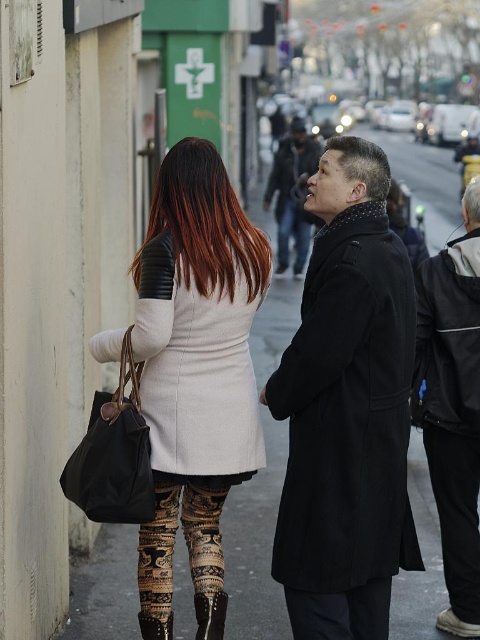
Question: Can you confirm if black wool coat at center is bigger than black leather jacket at right?

Choices:
 (A) yes
 (B) no

Answer: (B)

Question: Is ombre brown hair at center to the right of brown textured leggings at lower center from the viewer's perspective?

Choices:
 (A) yes
 (B) no

Answer: (A)

Question: Which point is closer to the camera?

Choices:
 (A) leather leggings at left
 (B) gray matte hair at center
 (C) ombre brown hair at center
 (D) black leather jacket at right

Answer: (A)

Question: Which object is the closest to the dark gray coat at center?

Choices:
 (A) white matte hair at upper center
 (B) ombre brown hair at center

Answer: (A)

Question: Is black leather pants at lower right to the left of gray matte hair at center from the viewer's perspective?

Choices:
 (A) no
 (B) yes

Answer: (A)

Question: Which object is the farthest from the black leather jacket at right?

Choices:
 (A) matte white coat at center
 (B) gray matte hair at center

Answer: (B)